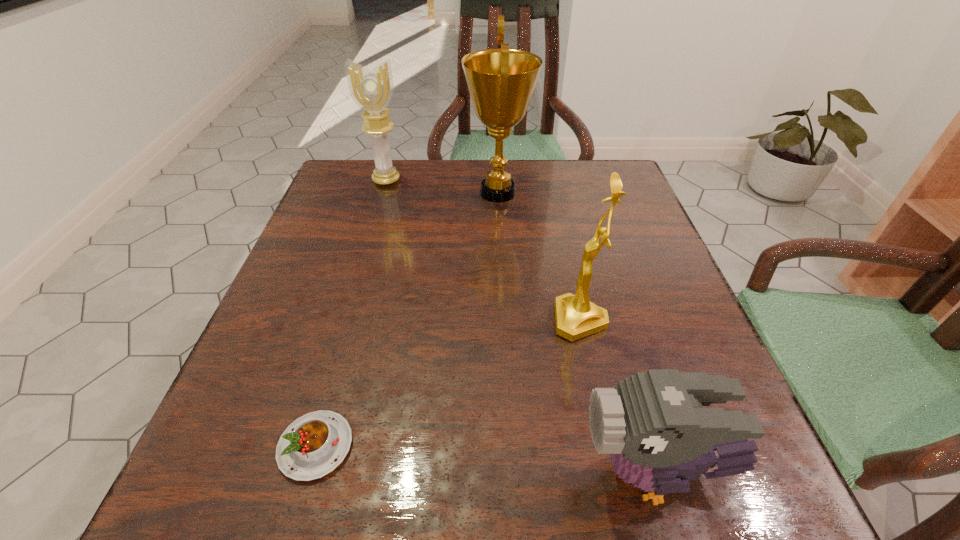
Locate an element on the screen. The height and width of the screenshot is (540, 960). award present at the left edge is located at coordinates (371, 90).

I want to click on pudding that is at the left edge, so 312,446.

Find the location of a particular element. award located in the right edge section of the desktop is located at coordinates click(x=576, y=317).

Where is `bird located at the right edge`? This screenshot has width=960, height=540. bird located at the right edge is located at coordinates (653, 424).

Find the location of `object present at the far left corner`. object present at the far left corner is located at coordinates (371, 90).

Locate an element on the screen. The width and height of the screenshot is (960, 540). object positioned at the near left corner is located at coordinates (312, 446).

Identify the location of object that is positioned at the near right corner. (x=653, y=424).

Identify the location of free space at the far edge. Image resolution: width=960 pixels, height=540 pixels. [553, 205].

This screenshot has height=540, width=960. I want to click on blank space at the near edge of the desktop, so click(x=625, y=496).

The width and height of the screenshot is (960, 540). Find the location of `vacant space at the left edge of the desktop`. vacant space at the left edge of the desktop is located at coordinates (276, 334).